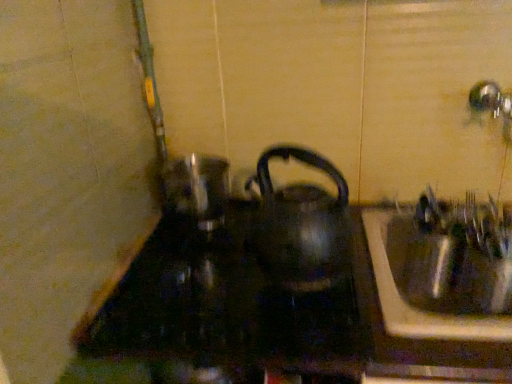
Question: Considering the positions of metallic sink at right and black glass stove at center in the image, is metallic sink at right taller or shorter than black glass stove at center?

Choices:
 (A) tall
 (B) short

Answer: (A)

Question: Is metallic sink at right to the left or to the right of black glass stove at center in the image?

Choices:
 (A) left
 (B) right

Answer: (B)

Question: Considering the real-world distances, which object is farthest from the black glass stove at center?

Choices:
 (A) black glossy kettle at center
 (B) metallic sink at right

Answer: (A)

Question: Which object is the closest to the metallic sink at right?

Choices:
 (A) black glass stove at center
 (B) black glossy kettle at center

Answer: (A)